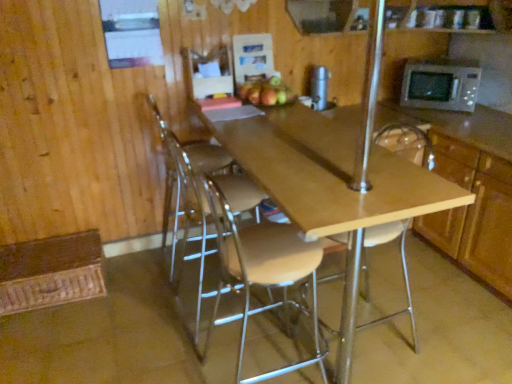
Locate an element on the screen. Image resolution: width=512 pixels, height=384 pixels. clear plastic chair at center, which is counted as the first chair, starting from the left is located at coordinates (190, 202).

Where is `silver metallic thermos at upper center`? This screenshot has height=384, width=512. silver metallic thermos at upper center is located at coordinates (319, 87).

This screenshot has height=384, width=512. I want to click on brown woven mat at lower left, so [x=51, y=272].

The image size is (512, 384). What do you see at coordinates (401, 266) in the screenshot?
I see `wooden seat at center, placed as the 3th chair when sorted from left to right` at bounding box center [401, 266].

This screenshot has height=384, width=512. What do you see at coordinates (331, 186) in the screenshot?
I see `light wood/matte table at center` at bounding box center [331, 186].

In order to face light brown wood stool at center, positioned as the second chair in left-to-right order, should I rotate leftwards or rightwards?

Turn right by 1.305 degrees to look at light brown wood stool at center, positioned as the second chair in left-to-right order.

Locate an element on the screen. This screenshot has width=512, height=384. clear plastic chair at center, which is the third chair from right to left is located at coordinates (190, 202).

Image resolution: width=512 pixels, height=384 pixels. I want to click on the 1st chair below when counting from the wooden cabinet at right (from the image's perspective), so click(401, 266).

Is wooden seat at center, placed as the 3th chair when sorted from left to right, facing towards wooden cabinet at right?

No.

Considering the relative positions of wooden seat at center, placed as the 3th chair when sorted from left to right, and wooden cabinet at right in the image provided, is wooden seat at center, placed as the 3th chair when sorted from left to right, to the left of wooden cabinet at right from the viewer's perspective?

Yes, wooden seat at center, placed as the 3th chair when sorted from left to right, is to the left of wooden cabinet at right.

From the image's perspective, which one is positioned lower, matte brown apple at center or light wood/matte table at center?

From the image's view, light wood/matte table at center is below.

Looking at this image, between matte brown apple at center and light wood/matte table at center, which one appears on the left side from the viewer's perspective?

Positioned to the left is matte brown apple at center.

What are the coordinates of `table below the matte brown apple at center (from the image's perspective)` in the screenshot? It's located at (331, 186).

From a real-world perspective, between matte brown apple at center and light wood/matte table at center, who is vertically lower?

In real-world perspective, light wood/matte table at center is lower.

Which chair is the 2nd one when counting from the front of the clear plastic chair at center, which is the third chair from right to left? Please provide its 2D coordinates.

[(259, 264)]

Is clear plastic chair at center, which is counted as the first chair, starting from the left, facing towards light brown wood stool at center, positioned as the second chair in left-to-right order?

No, clear plastic chair at center, which is counted as the first chair, starting from the left, is not turned towards light brown wood stool at center, positioned as the second chair in left-to-right order.

Considering the sizes of objects clear plastic chair at center, which is counted as the first chair, starting from the left, and light brown wood stool at center, positioned as the second chair in left-to-right order, in the image provided, who is thinner, clear plastic chair at center, which is counted as the first chair, starting from the left, or light brown wood stool at center, positioned as the second chair in left-to-right order,?

With smaller width is light brown wood stool at center, positioned as the second chair in left-to-right order.

How much distance is there between clear plastic chair at center, which is counted as the first chair, starting from the left, and light brown wood stool at center, positioned as the second chair in left-to-right order?

The distance of clear plastic chair at center, which is counted as the first chair, starting from the left, from light brown wood stool at center, positioned as the second chair in left-to-right order, is 15.96 inches.

Considering the positions of objects light wood/matte table at center and brown woven mat at lower left in the image provided, who is behind, light wood/matte table at center or brown woven mat at lower left?

brown woven mat at lower left is further from the camera.

In the scene shown: Is light wood/matte table at center far away from brown woven mat at lower left?

light wood/matte table at center is positioned a significant distance from brown woven mat at lower left.

How many degrees apart are the facing directions of light wood/matte table at center and brown woven mat at lower left?

A: The facing directions of light wood/matte table at center and brown woven mat at lower left are 1.5 degrees apart.

Would you say light wood/matte table at center is outside brown woven mat at lower left?

Absolutely, light wood/matte table at center is external to brown woven mat at lower left.

From a real-world perspective, which is physically above, light brown wood stool at center, positioned as the second chair in left-to-right order, or wooden seat at center, placed as the 3th chair when sorted from left to right?

From a 3D spatial view, wooden seat at center, placed as the 3th chair when sorted from left to right, is above.

How much distance is there between light brown wood stool at center, positioned as the 2th chair in right-to-left order, and wooden seat at center, placed as the 3th chair when sorted from left to right?

They are 31.96 inches apart.

Is light brown wood stool at center, positioned as the 2th chair in right-to-left order, shorter than wooden seat at center, the 1th chair positioned from the right?

Yes.

Would you say light brown wood stool at center, positioned as the second chair in left-to-right order, is to the left or to the right of wooden seat at center, placed as the 3th chair when sorted from left to right, in the picture?

From the image, it's evident that light brown wood stool at center, positioned as the second chair in left-to-right order, is to the left of wooden seat at center, placed as the 3th chair when sorted from left to right.

Considering the positions of point (236, 267) and point (186, 208), is point (236, 267) closer or farther from the camera than point (186, 208)?

Clearly, point (236, 267) is closer to the camera than point (186, 208).

Locate an element on the screen. the 2nd chair above when counting from the light brown wood stool at center, positioned as the second chair in left-to-right order (from the image's perspective) is located at coordinates (190, 202).

From a real-world perspective, which is physically below, light brown wood stool at center, positioned as the second chair in left-to-right order, or clear plastic chair at center, which is the third chair from right to left?

A: clear plastic chair at center, which is the third chair from right to left, is physically lower.

From a real-world perspective, is wooden cabinet at right positioned above or below brown woven mat at lower left?

wooden cabinet at right is situated higher than brown woven mat at lower left in the real world.

Which object is closer to the camera taking this photo, wooden cabinet at right or brown woven mat at lower left?

wooden cabinet at right is in front.

From the image's perspective, is wooden cabinet at right under brown woven mat at lower left?

No, from the image's perspective, wooden cabinet at right is not below brown woven mat at lower left.

Which is correct: wooden cabinet at right is inside brown woven mat at lower left, or outside of it?

wooden cabinet at right is not inside brown woven mat at lower left, it's outside.

Locate an element on the screen. the 3rd chair directly above the wooden cabinet at right (from a real-world perspective) is located at coordinates (401, 266).

Identify the location of apple behind the light wood/matte table at center. This screenshot has height=384, width=512. (266, 92).

Estimate the real-world distances between objects in this image. Which object is further from silver metallic thermos at upper center, light brown wood stool at center, positioned as the 2th chair in right-to-left order, or clear plastic chair at center, which is the third chair from right to left?

Among the two, light brown wood stool at center, positioned as the 2th chair in right-to-left order, is located further to silver metallic thermos at upper center.

Looking at the image, which one is located further to wooden seat at center, placed as the 3th chair when sorted from left to right, clear plastic chair at center, which is the third chair from right to left, or silver metallic thermos at upper center?

silver metallic thermos at upper center is positioned further to the anchor wooden seat at center, placed as the 3th chair when sorted from left to right.

Which object lies further to the anchor point light wood/matte table at center, wooden seat at center, the 1th chair positioned from the right, or matte brown apple at center?

wooden seat at center, the 1th chair positioned from the right.

From the picture: When comparing their distances from light brown wood stool at center, positioned as the 2th chair in right-to-left order, does wooden cabinet at right or clear plastic chair at center, which is counted as the first chair, starting from the left, seem further?

wooden cabinet at right is further to light brown wood stool at center, positioned as the 2th chair in right-to-left order.

Considering their positions, is brown woven mat at lower left positioned further to wooden seat at center, the 1th chair positioned from the right, than wooden cabinet at right?

brown woven mat at lower left is further to wooden seat at center, the 1th chair positioned from the right.

Based on their spatial positions, is light wood/matte table at center or light brown wood stool at center, positioned as the second chair in left-to-right order, further from silver metallic microwave at upper right?

light brown wood stool at center, positioned as the second chair in left-to-right order, lies further to silver metallic microwave at upper right than the other object.

Looking at the image, which one is located further to matte brown apple at center, wooden cabinet at right or wooden seat at center, the 1th chair positioned from the right?

wooden cabinet at right is positioned further to the anchor matte brown apple at center.

Considering their positions, is matte brown apple at center positioned closer to light wood/matte table at center than wooden seat at center, the 1th chair positioned from the right?

matte brown apple at center is closer to light wood/matte table at center.

I want to click on cabinetry between wooden seat at center, the 1th chair positioned from the right, and silver metallic thermos at upper center, along the z-axis, so click(474, 213).

Locate an element on the screen. appliance between matte brown apple at center and wooden cabinet at right is located at coordinates (319, 87).

Identify the location of apple between light wood/matte table at center and silver metallic microwave at upper right from front to back. Image resolution: width=512 pixels, height=384 pixels. (266, 92).

Locate an element on the screen. apple located between clear plastic chair at center, which is counted as the first chair, starting from the left, and silver metallic thermos at upper center in the left-right direction is located at coordinates (266, 92).